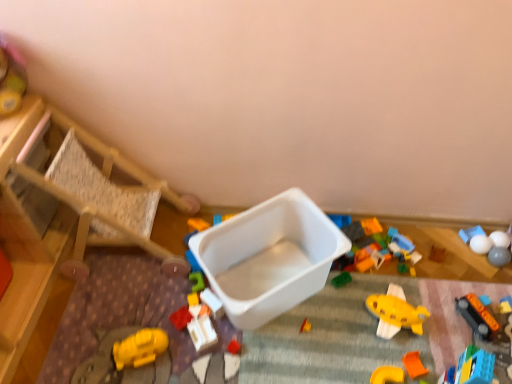
Locate an element on the screen. unoccupied region to the right of orange matte block at lower right, arranged as the eighth toy when viewed from the left is located at coordinates (456, 349).